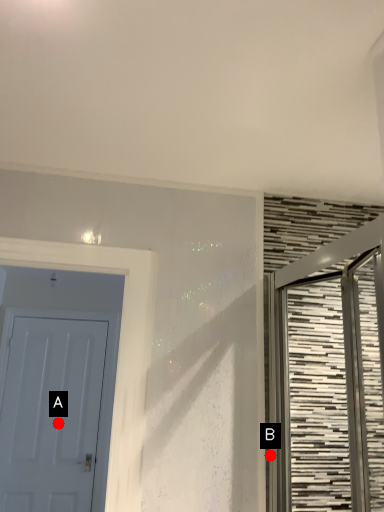
Question: Two points are circled on the image, labeled by A and B beside each circle. Which point is farther from the camera taking this photo?

Choices:
 (A) A is further
 (B) B is further

Answer: (A)